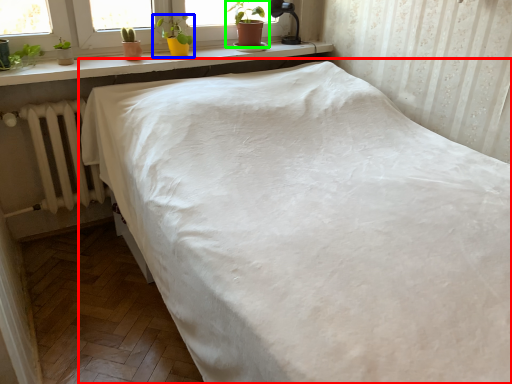
Question: Estimate the real-world distances between objects in this image. Which object is farther from bed (highlighted by a red box), houseplant (highlighted by a blue box) or houseplant (highlighted by a green box)?

Choices:
 (A) houseplant
 (B) houseplant

Answer: (B)